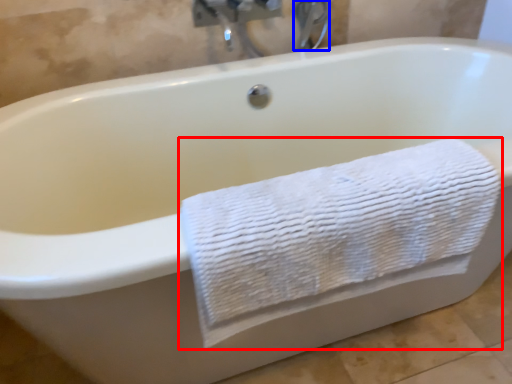
Question: Among these objects, which one is nearest to the camera, towel (highlighted by a red box) or faucet (highlighted by a blue box)?

Choices:
 (A) towel
 (B) faucet

Answer: (A)